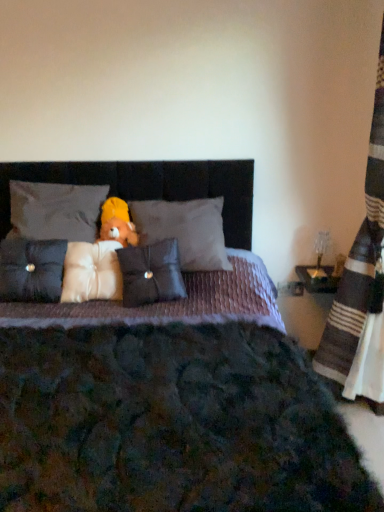
Question: From a real-world perspective, does translucent glass table lamp at right sit lower than white satin pillow at upper center, arranged as the fourth pillow when viewed from the right?

Choices:
 (A) no
 (B) yes

Answer: (B)

Question: From a real-world perspective, is translucent glass table lamp at right on top of white satin pillow at upper center, positioned as the second pillow in left-to-right order?

Choices:
 (A) no
 (B) yes

Answer: (A)

Question: Considering the relative sizes of translucent glass table lamp at right and white satin pillow at upper center, arranged as the fourth pillow when viewed from the right, in the image provided, is translucent glass table lamp at right shorter than white satin pillow at upper center, arranged as the fourth pillow when viewed from the right,?

Choices:
 (A) no
 (B) yes

Answer: (B)

Question: Is translucent glass table lamp at right to the right of white satin pillow at upper center, positioned as the second pillow in left-to-right order, from the viewer's perspective?

Choices:
 (A) no
 (B) yes

Answer: (B)

Question: Are translucent glass table lamp at right and white satin pillow at upper center, positioned as the second pillow in left-to-right order, located far from each other?

Choices:
 (A) no
 (B) yes

Answer: (B)

Question: Considering the relative sizes of translucent glass table lamp at right and white satin pillow at upper center, arranged as the fourth pillow when viewed from the right, in the image provided, is translucent glass table lamp at right bigger than white satin pillow at upper center, arranged as the fourth pillow when viewed from the right,?

Choices:
 (A) yes
 (B) no

Answer: (B)

Question: From the image's perspective, is yellow plush bear at center below velvet purple bed at center?

Choices:
 (A) yes
 (B) no

Answer: (B)

Question: Does yellow plush bear at center have a lesser width compared to velvet purple bed at center?

Choices:
 (A) no
 (B) yes

Answer: (B)

Question: Would you say velvet purple bed at center is part of yellow plush bear at center's contents?

Choices:
 (A) yes
 (B) no

Answer: (B)

Question: Considering the relative positions of yellow plush bear at center and velvet purple bed at center in the image provided, is yellow plush bear at center to the left of velvet purple bed at center from the viewer's perspective?

Choices:
 (A) yes
 (B) no

Answer: (A)

Question: Does yellow plush bear at center have a larger size compared to velvet purple bed at center?

Choices:
 (A) no
 (B) yes

Answer: (A)

Question: From the image's perspective, is yellow plush bear at center on top of velvet purple bed at center?

Choices:
 (A) no
 (B) yes

Answer: (B)

Question: Is suede-like gray pillow at left, arranged as the 5th pillow when viewed from the right, next to translucent glass table lamp at right?

Choices:
 (A) yes
 (B) no

Answer: (B)